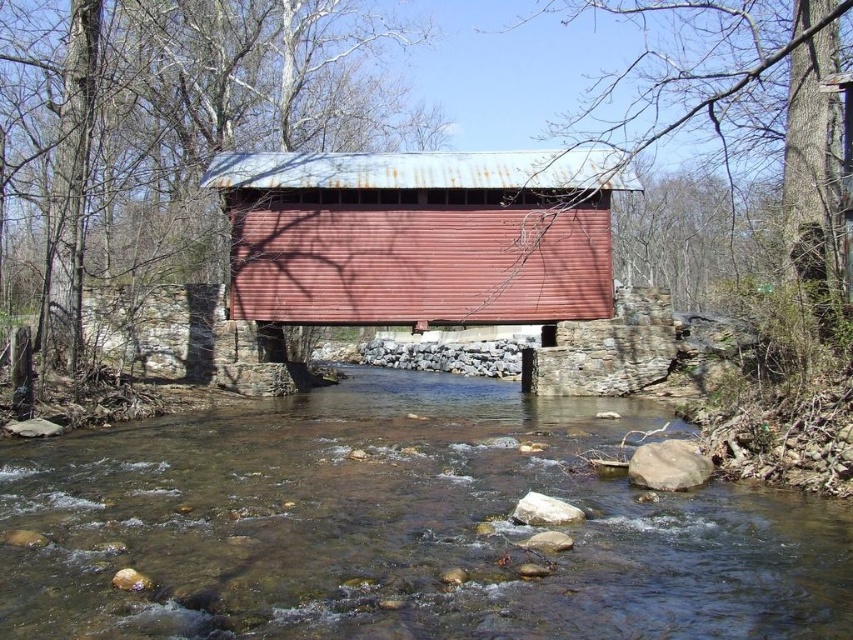
You are standing on a path near the river and want to take a photo of the rusty metal bridge at center without the clear water at center appearing in the foreground. Is this possible given their positions?

The clear water at center is closer to the viewer than the rusty metal bridge at center. Therefore, it would be challenging to take a photo of the rusty metal bridge at center without the clear water at center appearing in the foreground since the water is in front of the bridge.

You are standing on the covered bridge and want to take a photo of two specific points on the bridge. The first point is at coordinates point (381, 582) and the second is at point (436, 317). Which point is nearer to you when you are facing the bridge?

Point (381, 582) is closer to the viewer than point (436, 317).